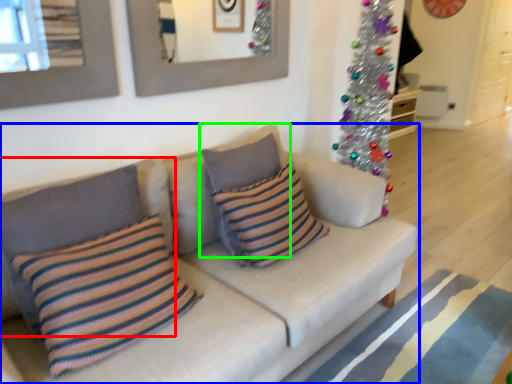
Question: Estimate the real-world distances between objects in this image. Which object is farther from pillow (highlighted by a red box), studio couch (highlighted by a blue box) or pillow (highlighted by a green box)?

Choices:
 (A) studio couch
 (B) pillow

Answer: (B)